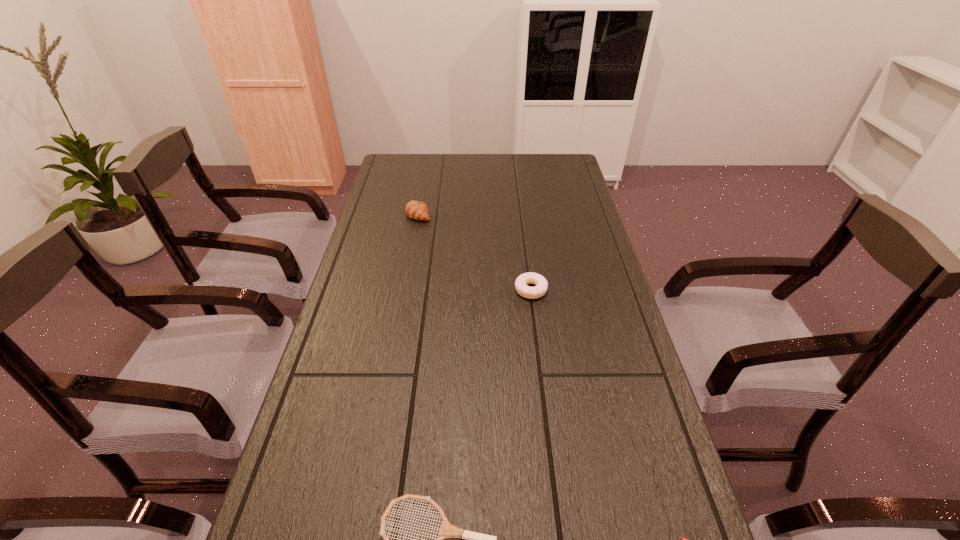
I want to click on crescent roll, so click(416, 210).

Identify the location of the tallest object. (416, 210).

Locate an element on the screen. Image resolution: width=960 pixels, height=540 pixels. the third shortest object is located at coordinates (541, 284).

Where is `doughnut`? This screenshot has width=960, height=540. doughnut is located at coordinates (541, 284).

Identify the location of blank space located on the back of the crescent roll. The image size is (960, 540). (421, 195).

Where is `free location located on the left of the third object from left to right`? This screenshot has width=960, height=540. free location located on the left of the third object from left to right is located at coordinates (472, 290).

Locate an element on the screen. This screenshot has height=540, width=960. object located at the left edge is located at coordinates (416, 210).

Find the location of a particular element. vacant space at the far edge of the desktop is located at coordinates (468, 156).

You are a GUI agent. You are given a task and a screenshot of the screen. Output one action in this format:
    pyautogui.click(x=<x>, y=<y>)
    Task: Click on the free region at the left edge
    The image size is (960, 540).
    Given the screenshot: What is the action you would take?
    pyautogui.click(x=370, y=274)

You are a GUI agent. You are given a task and a screenshot of the screen. Output one action in this format:
    pyautogui.click(x=<x>, y=<y>)
    Task: Click on the vacant position at the right edge of the desktop
    The image size is (960, 540).
    Given the screenshot: What is the action you would take?
    pyautogui.click(x=577, y=269)